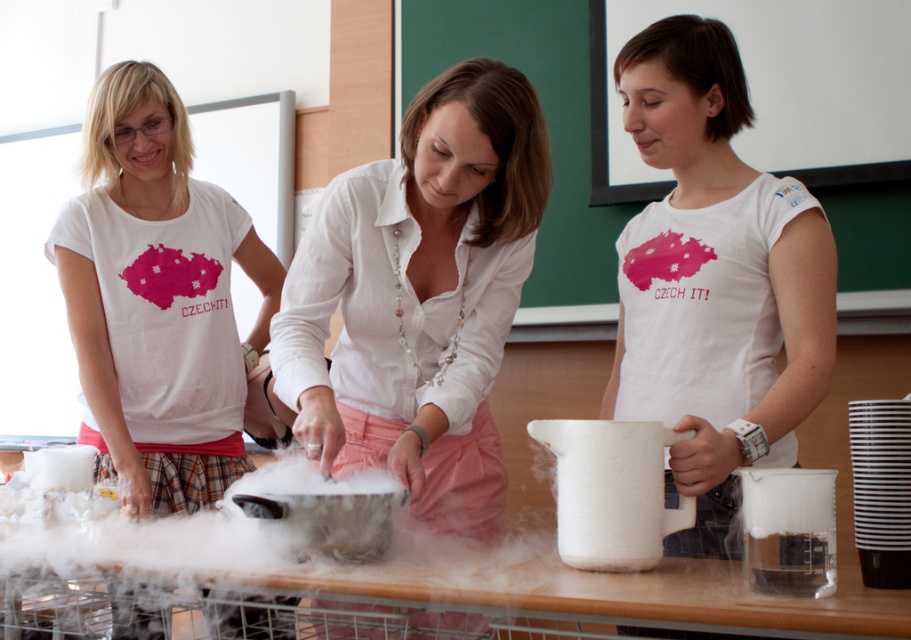
You are a photographer trying to capture a clear shot of both the white linen shirt at center and the matte white shirt at center. Since they are both at the center, which one is positioned to the right?

The white linen shirt at center is positioned to the right of the matte white shirt at center.